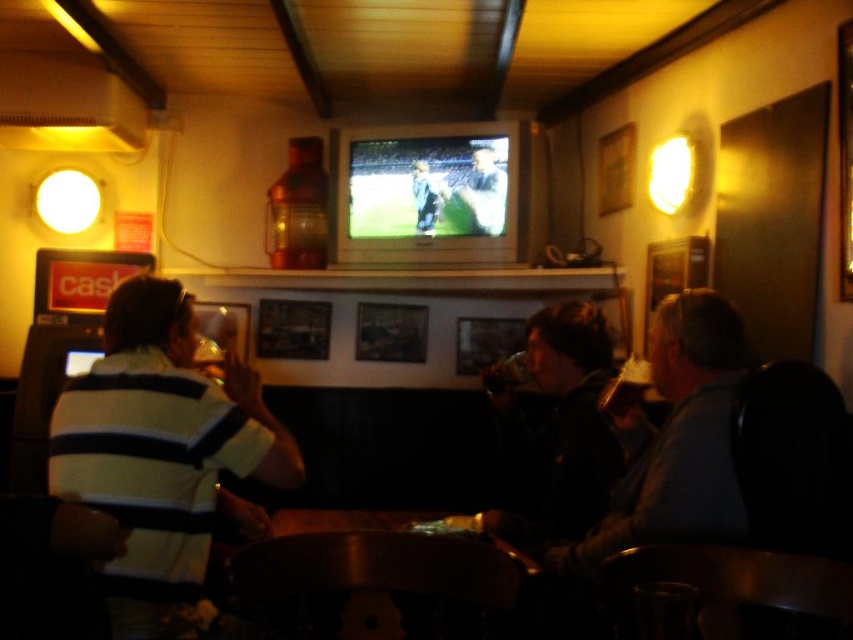
Question: Considering the real-world distances, which object is closest to the light blue jersey at center?

Choices:
 (A) wooden table at center
 (B) dark blue jersey at center

Answer: (B)

Question: Which of the following is the farthest from the observer?

Choices:
 (A) striped cotton shirt at left
 (B) light blue jersey at center
 (C) wooden table at center
 (D) dark blue jersey at center

Answer: (D)

Question: Which object is positioned farthest from the wooden table at center?

Choices:
 (A) striped cotton shirt at left
 (B) dark blue jersey at center
 (C) light blue jersey at center

Answer: (C)

Question: Does striped cotton shirt at left appear on the left side of light blue jersey at center?

Choices:
 (A) no
 (B) yes

Answer: (B)

Question: Is striped cotton shirt at left to the left of light blue jersey at center from the viewer's perspective?

Choices:
 (A) yes
 (B) no

Answer: (A)

Question: Does striped cotton shirt at left appear over wooden table at center?

Choices:
 (A) no
 (B) yes

Answer: (B)